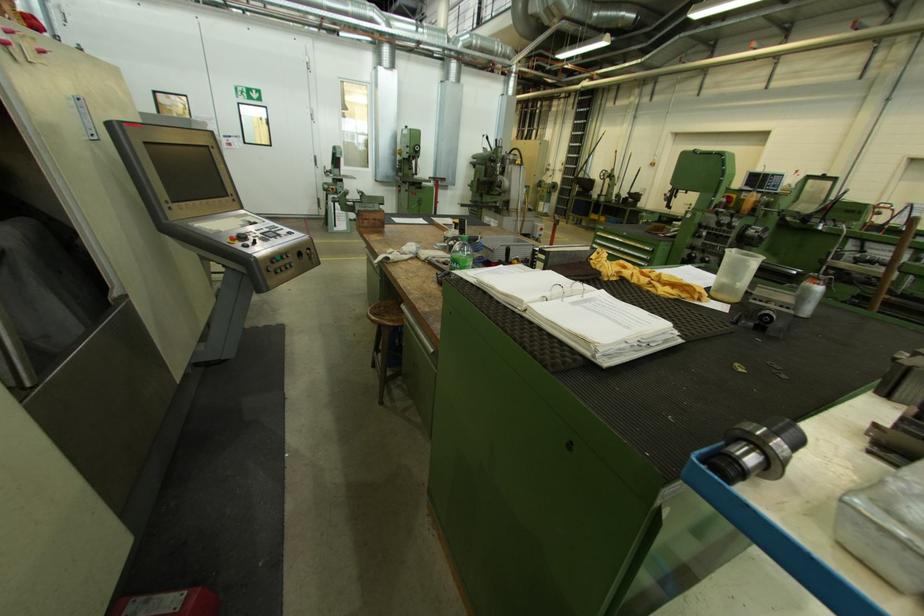
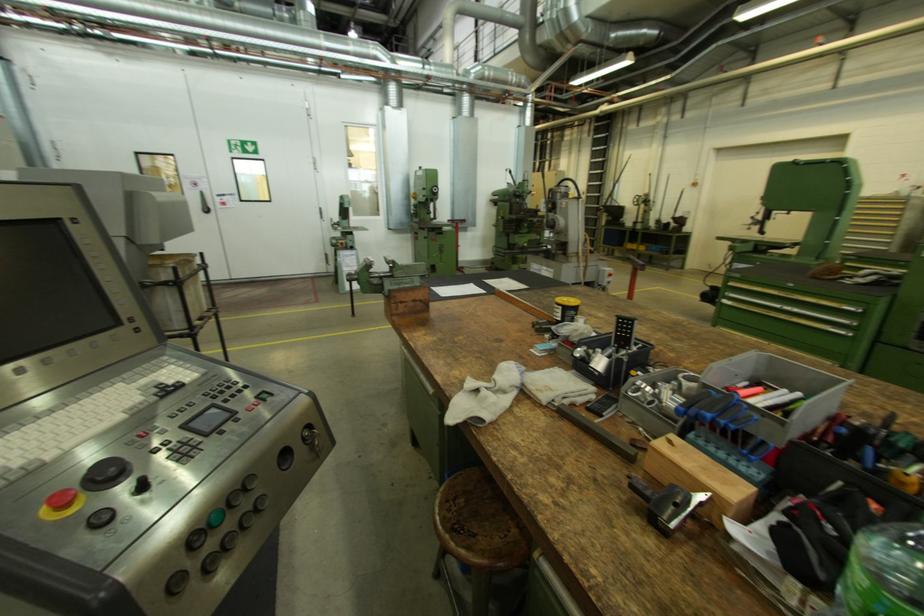
What movement of the cameraman would produce the second image?

The cameraman moved toward left, forward.